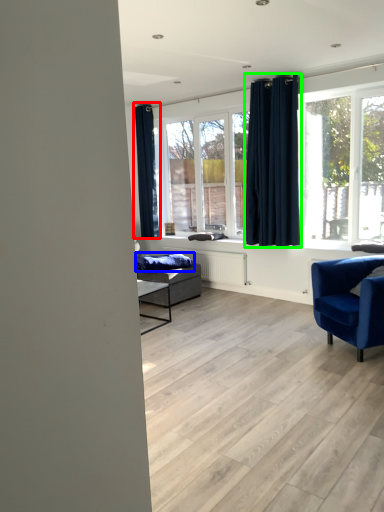
Question: Considering the real-world distances, which object is farthest from curtain (highlighted by a red box)? blanket (highlighted by a blue box) or curtain (highlighted by a green box)?

Choices:
 (A) blanket
 (B) curtain

Answer: (B)